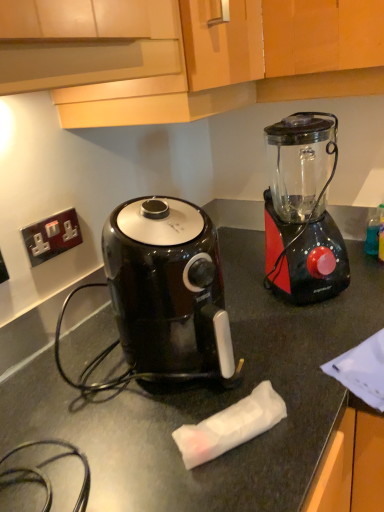
Question: From the image's perspective, is metallic socket at upper left under wooden cabinet at upper center?

Choices:
 (A) no
 (B) yes

Answer: (B)

Question: Considering the relative positions of metallic socket at upper left and wooden cabinet at upper center in the image provided, is metallic socket at upper left to the right of wooden cabinet at upper center from the viewer's perspective?

Choices:
 (A) no
 (B) yes

Answer: (A)

Question: Is metallic socket at upper left smaller than wooden cabinet at upper center?

Choices:
 (A) yes
 (B) no

Answer: (A)

Question: Considering the relative sizes of metallic socket at upper left and wooden cabinet at upper center in the image provided, is metallic socket at upper left bigger than wooden cabinet at upper center?

Choices:
 (A) yes
 (B) no

Answer: (B)

Question: Is metallic socket at upper left placed right next to wooden cabinet at upper center?

Choices:
 (A) yes
 (B) no

Answer: (B)

Question: From a real-world perspective, is black glossy air fryer at center above or below black plastic blender at right?

Choices:
 (A) above
 (B) below

Answer: (B)

Question: From the image's perspective, relative to black plastic blender at right, is black glossy air fryer at center above or below?

Choices:
 (A) above
 (B) below

Answer: (B)

Question: Is black glossy air fryer at center inside or outside of black plastic blender at right?

Choices:
 (A) outside
 (B) inside

Answer: (A)

Question: Relative to black plastic blender at right, is black glossy air fryer at center in front or behind?

Choices:
 (A) front
 (B) behind

Answer: (A)

Question: In the image, is black glossy air fryer at center on the left side or the right side of wooden cabinet at upper center?

Choices:
 (A) right
 (B) left

Answer: (B)

Question: Considering the positions of black glossy air fryer at center and wooden cabinet at upper center in the image, is black glossy air fryer at center taller or shorter than wooden cabinet at upper center?

Choices:
 (A) short
 (B) tall

Answer: (B)

Question: In terms of size, does black glossy air fryer at center appear bigger or smaller than wooden cabinet at upper center?

Choices:
 (A) small
 (B) big

Answer: (A)

Question: Considering their positions, is black glossy air fryer at center located in front of or behind wooden cabinet at upper center?

Choices:
 (A) behind
 (B) front

Answer: (A)

Question: From a real-world perspective, is metallic socket at upper left physically located above or below wooden cabinet at upper center?

Choices:
 (A) above
 (B) below

Answer: (B)

Question: Is metallic socket at upper left spatially inside wooden cabinet at upper center, or outside of it?

Choices:
 (A) inside
 (B) outside

Answer: (B)